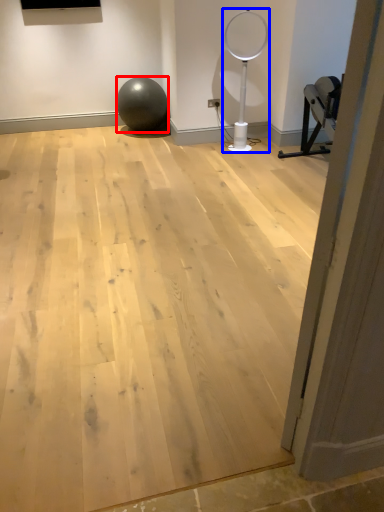
Question: Among these objects, which one is nearest to the camera, ball (highlighted by a red box) or basketball hoop (highlighted by a blue box)?

Choices:
 (A) ball
 (B) basketball hoop

Answer: (B)